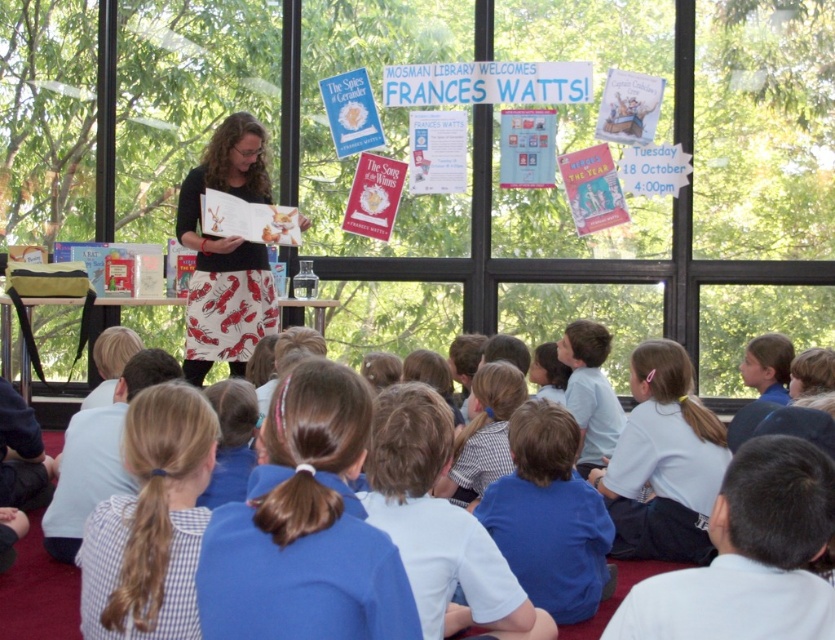
Is blue fabric shirt at center below printed cotton skirt at center?

Yes, blue fabric shirt at center is below printed cotton skirt at center.

Is point (555, 605) positioned in front of point (186, 211)?

Yes, point (555, 605) is closer to viewer.

The image size is (835, 640). Describe the element at coordinates (549, 516) in the screenshot. I see `blue fabric shirt at center` at that location.

Identify the location of blue fabric shirt at center. (549, 516).

Who is taller, blue gingham shirt at lower left or matte paper book at center?

blue gingham shirt at lower left

Identify the location of blue gingham shirt at lower left. (150, 522).

Which is in front, point (142, 476) or point (279, 236)?

Point (142, 476)

Image resolution: width=835 pixels, height=640 pixels. In order to click on blue gingham shirt at lower left in this screenshot , I will do `click(150, 522)`.

Does white uniform at center appear on the left side of blue fabric shirt at center?

In fact, white uniform at center is to the right of blue fabric shirt at center.

The image size is (835, 640). I want to click on white uniform at center, so click(663, 461).